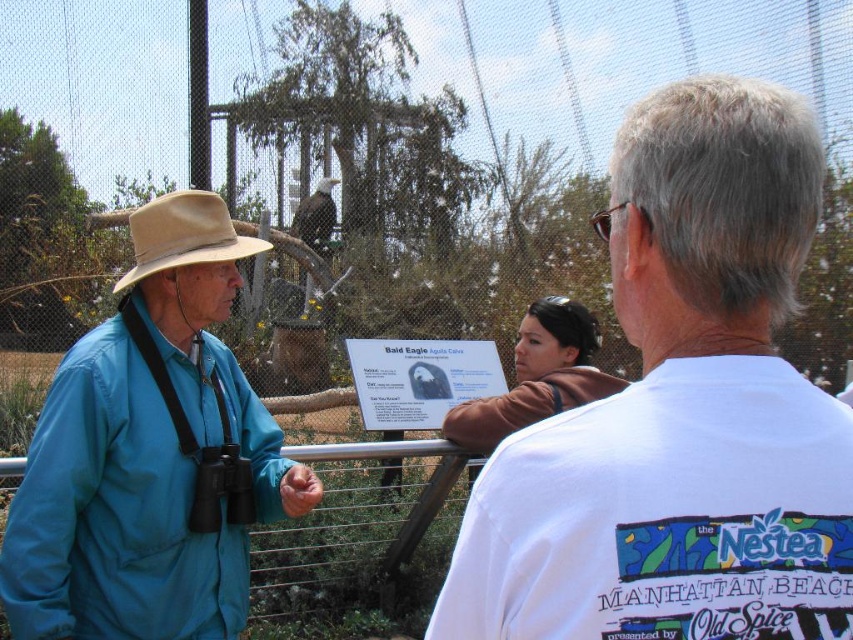
Can you confirm if matte blue shirt at left is bigger than brushed metal rail at center?

Incorrect, matte blue shirt at left is not larger than brushed metal rail at center.

Is matte blue shirt at left positioned at the back of brushed metal rail at center?

No, matte blue shirt at left is in front of brushed metal rail at center.

Locate an element on the screen. The width and height of the screenshot is (853, 640). matte blue shirt at left is located at coordinates (149, 454).

Who is more distant from viewer, (x=548, y=147) or (x=374, y=444)?

The point (x=548, y=147) is behind.

Consider the image. Which is below, metal wire fence at center or brushed metal rail at center?

brushed metal rail at center is below.

Is point (421, 200) less distant than point (0, 536)?

No, (421, 200) is behind (0, 536).

You are a GUI agent. You are given a task and a screenshot of the screen. Output one action in this format:
    pyautogui.click(x=<x>, y=<y>)
    Task: Click on the metal wire fence at center
    The image size is (853, 640).
    Given the screenshot: What is the action you would take?
    pyautogui.click(x=410, y=186)

Which is behind, point (227, 237) or point (444, 448)?

The point (444, 448) is more distant.

Is point (157, 266) positioned after point (395, 445)?

No.

Find the location of a particular element. beige felt cowboy hat at left is located at coordinates 183,234.